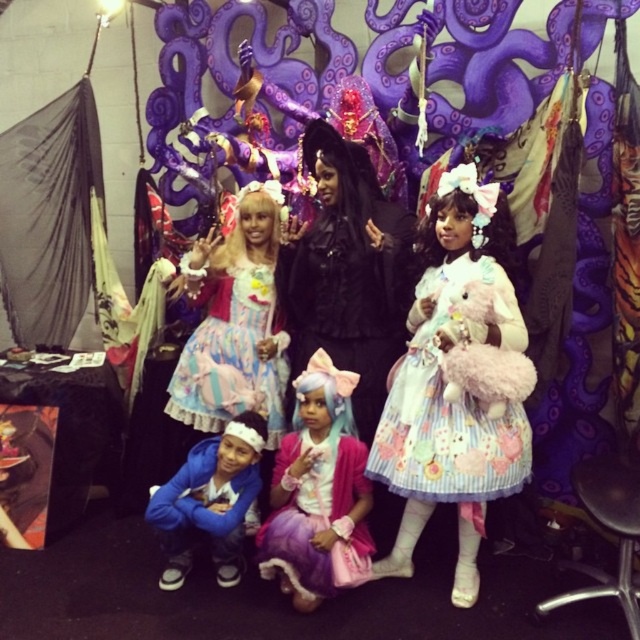
In the scene shown: You are standing in the convention hall and want to take a photo of the pastel striped dress at center. If your camera has a maximum focus range of 2 meters, will you be able to capture the dress clearly?

The pastel striped dress at center is 2.02 meters away from the viewer. Since the camera can focus up to 2 meters, the dress is slightly out of range and cannot be captured clearly.

You are standing in front of the group of people in the image. There are two points marked on the image. The first point is at coordinate point (445, 189) and the second point is at coordinate point (294, 356). Which point is closer to you?

Point (445, 189) is closer to the viewer than point (294, 356).

You are a photographer trying to capture a group photo of the scene. You need to ensure that both the pastel striped dress at center and the blue fleece jacket at lower left are clearly visible in the frame. Given their sizes, which object might require you to adjust your camera angle to accommodate its size?

The pastel striped dress at center has a larger width than the blue fleece jacket at lower left, so it might require adjusting the camera angle to ensure it fits within the frame.